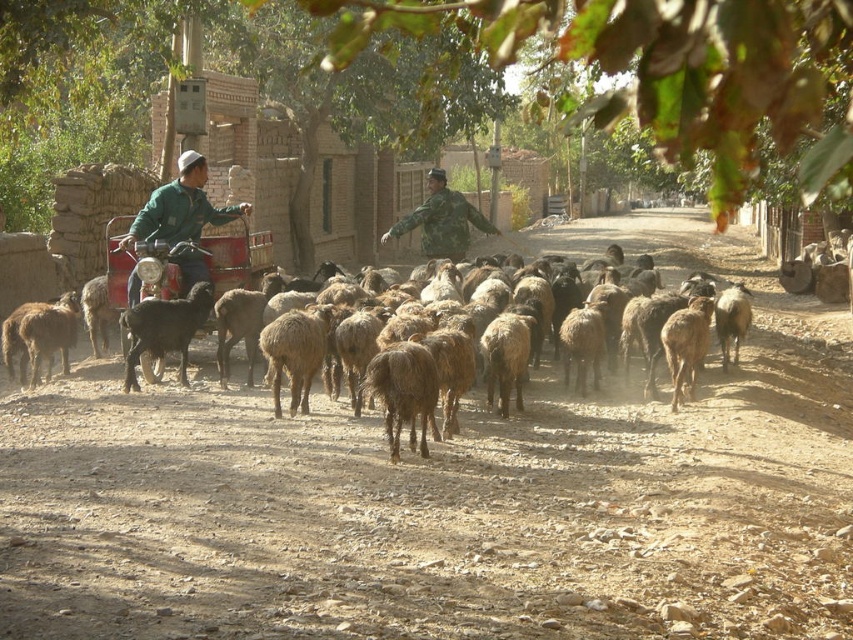
You are a traveler on the dirt road and see the black woolen goat at left and the camouflage uniform at center. Which animal or person is closer to your left side?

The black woolen goat at left is closer to your left side because it is positioned to the left of the camouflage uniform at center.

You are a farmer trying to count the animals in the scene. You see a black woolen goat at left and a camouflage uniform at center. Which animal is shorter in height?

The black woolen goat at left is shorter than the camouflage uniform at center.

You are a visitor in the village and want to take a photo of the camouflage uniform at center and the metallic red cart at left. Which object should you focus on first if you want to capture both in the same frame without moving your camera?

You should focus on the camouflage uniform at center first because the metallic red cart at left is to the left of camouflage uniform at center, so they are aligned horizontally and can be captured in the same frame by centering the camera between them.